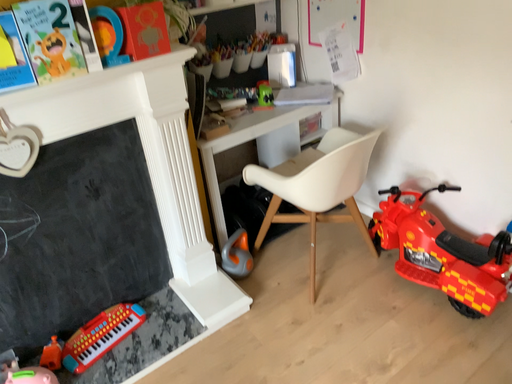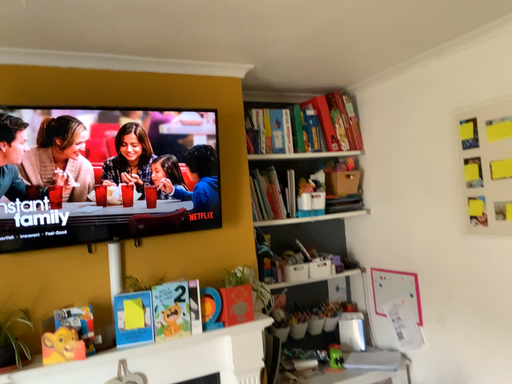
Question: Which way did the camera rotate in the video?

Choices:
 (A) rotated left
 (B) rotated right

Answer: (A)